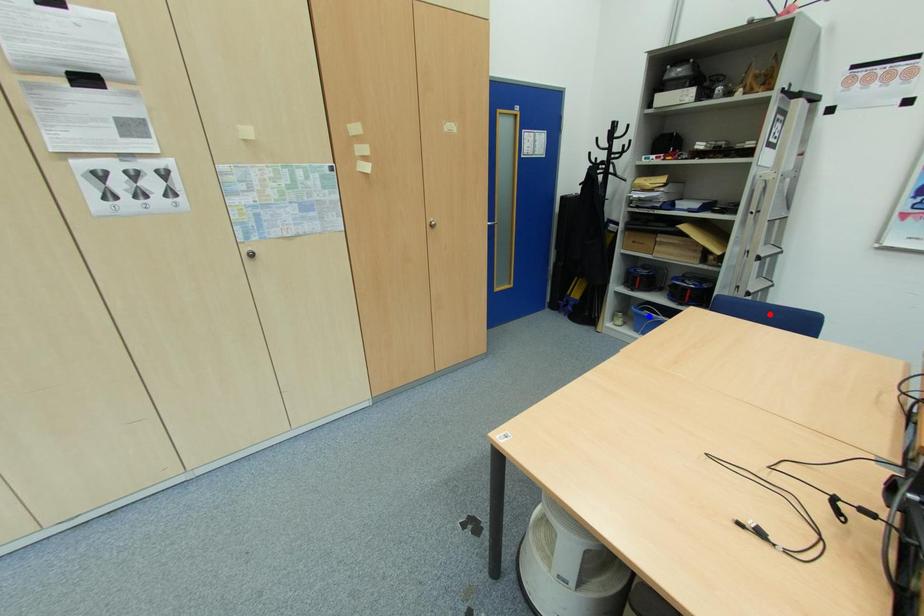
Question: Two points are marked on the image. Which point is closer to the camera?

Choices:
 (A) Blue point is closer.
 (B) Red point is closer.

Answer: (B)